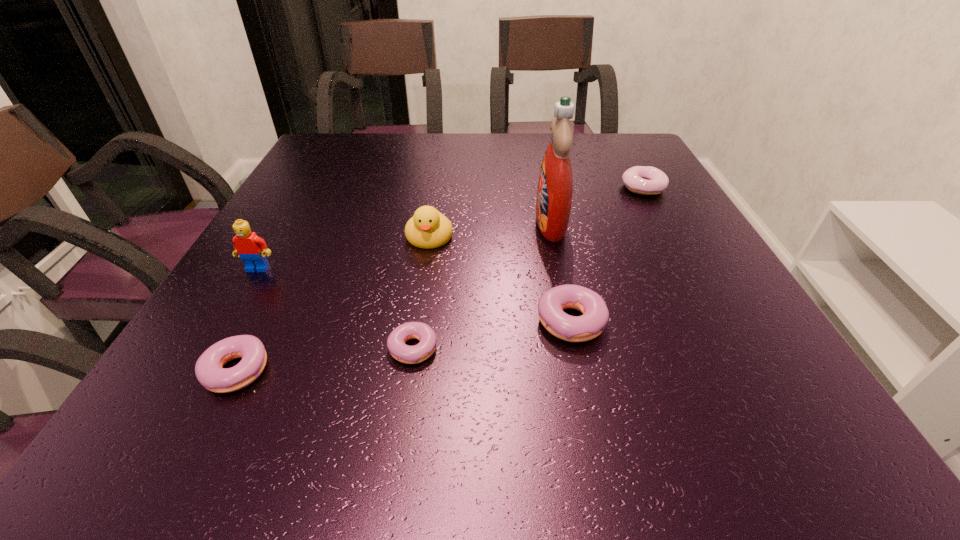
All doughnuts are currently evenly spaced. To continue this pattern, where would you add another doughnut on the right? Please point out a vacant spot. Please provide its 2D coordinates. Your answer should be formatted as a tuple, i.e. [(x, y)], where the tuple contains the x and y coordinates of a point satisfying the conditions above.

[(711, 298)]